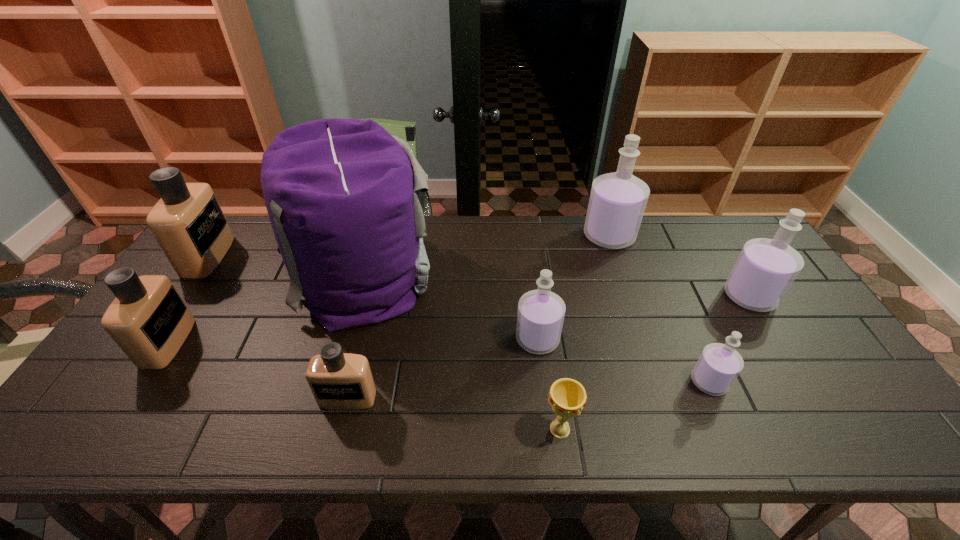
Image resolution: width=960 pixels, height=540 pixels. I want to click on free space located on the front label of the second biggest beige perfume, so click(x=211, y=343).

The image size is (960, 540). I want to click on free spot located on the left of the nearest purple perfume, so click(x=551, y=382).

Find the location of a particular element. free space located 0.070m on the front label of the nearest beige perfume is located at coordinates (337, 439).

Image resolution: width=960 pixels, height=540 pixels. Find the location of `free point located on the right of the chalice`. free point located on the right of the chalice is located at coordinates (662, 429).

Locate an element on the screen. Image resolution: width=960 pixels, height=540 pixels. backpack positioned at the far edge is located at coordinates (345, 198).

This screenshot has width=960, height=540. In order to click on perfume positioned at the near edge in this screenshot , I will do `click(339, 381)`.

The image size is (960, 540). I want to click on chalice that is at the near edge, so click(567, 397).

Where is `object that is at the right edge`? Image resolution: width=960 pixels, height=540 pixels. object that is at the right edge is located at coordinates (766, 268).

Where is `object that is at the far left corner`? object that is at the far left corner is located at coordinates (188, 223).

Identify the location of vacant area at the far edge of the desktop. (560, 256).